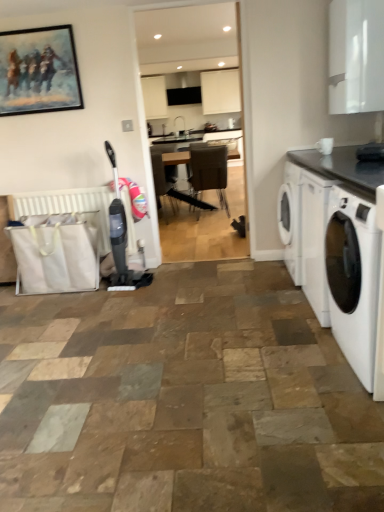
Question: From the image's perspective, is white fabric radiator at lower left positioned above or below brown leather chair at center?

Choices:
 (A) below
 (B) above

Answer: (A)

Question: In the image, is white fabric radiator at lower left positioned in front of or behind brown leather chair at center?

Choices:
 (A) front
 (B) behind

Answer: (A)

Question: Estimate the real-world distances between objects in this image. Which object is closer to the black granite countertop at right?

Choices:
 (A) oil painting at upper left
 (B) brown leather chair at center
 (C) white fabric radiator at lower left
 (D) white glossy washing machine at right

Answer: (D)

Question: Estimate the real-world distances between objects in this image. Which object is closer to the brown leather chair at center?

Choices:
 (A) oil painting at upper left
 (B) white glossy washing machine at right
 (C) white fabric radiator at lower left
 (D) black granite countertop at right

Answer: (C)